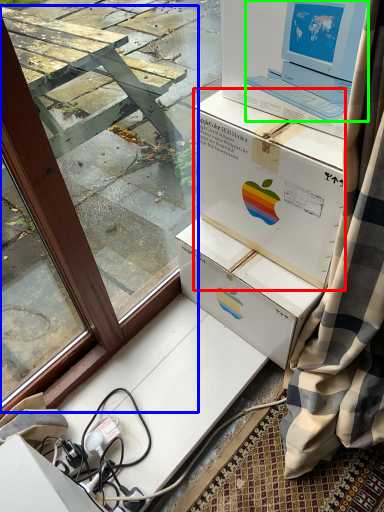
Question: Which object is the farthest from box (highlighted by a red box)? Choose among these: window frame (highlighted by a blue box) or laptop (highlighted by a green box).

Choices:
 (A) window frame
 (B) laptop

Answer: (A)